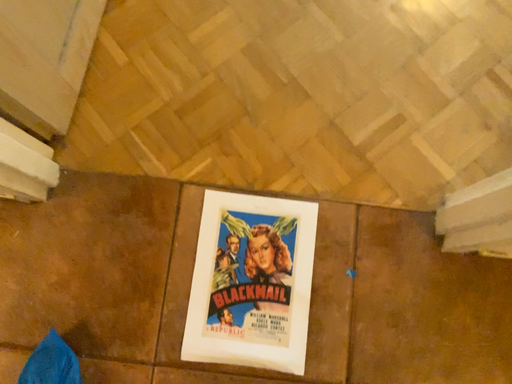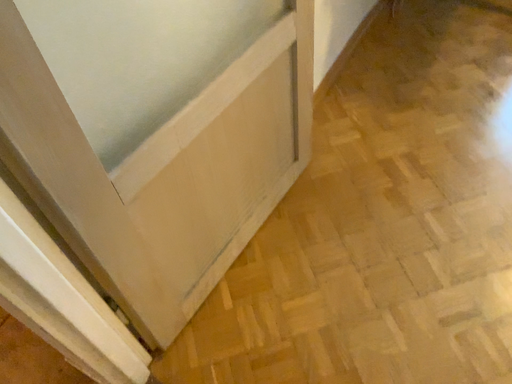
Question: Which way did the camera rotate in the video?

Choices:
 (A) rotated right
 (B) rotated left

Answer: (B)